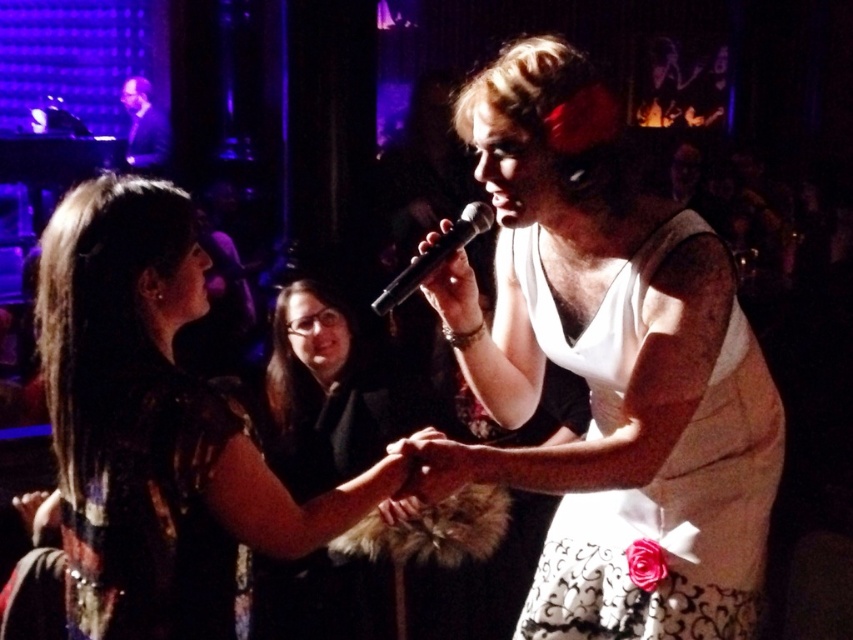
Question: Is black matte dress at center closer to the viewer compared to smooth black microphone at center?

Choices:
 (A) yes
 (B) no

Answer: (B)

Question: In this image, where is black sequined dress at center located relative to smooth black microphone at center?

Choices:
 (A) right
 (B) left

Answer: (B)

Question: Which point is farther to the camera?

Choices:
 (A) (306, 381)
 (B) (459, 248)
 (C) (370, 307)

Answer: (C)

Question: Which point is closer to the camera taking this photo?

Choices:
 (A) (80, 584)
 (B) (144, 100)

Answer: (A)

Question: Based on their relative distances, which object is nearer to the black sequined dress at center?

Choices:
 (A) smooth black microphone at center
 (B) white lace dress at center
 (C) shiny sequined dress at lower left

Answer: (C)

Question: Is white lace dress at center smaller than smooth black microphone at center?

Choices:
 (A) yes
 (B) no

Answer: (B)